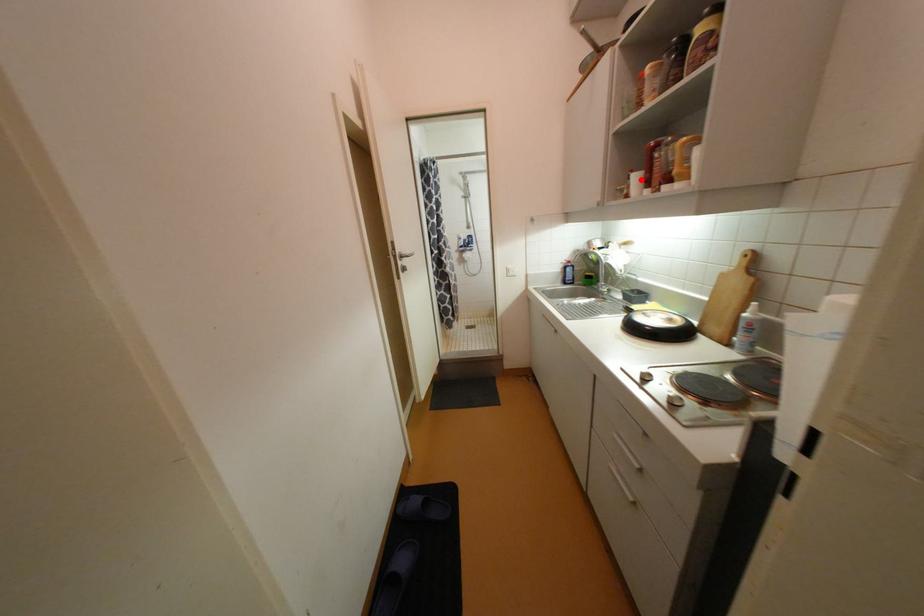
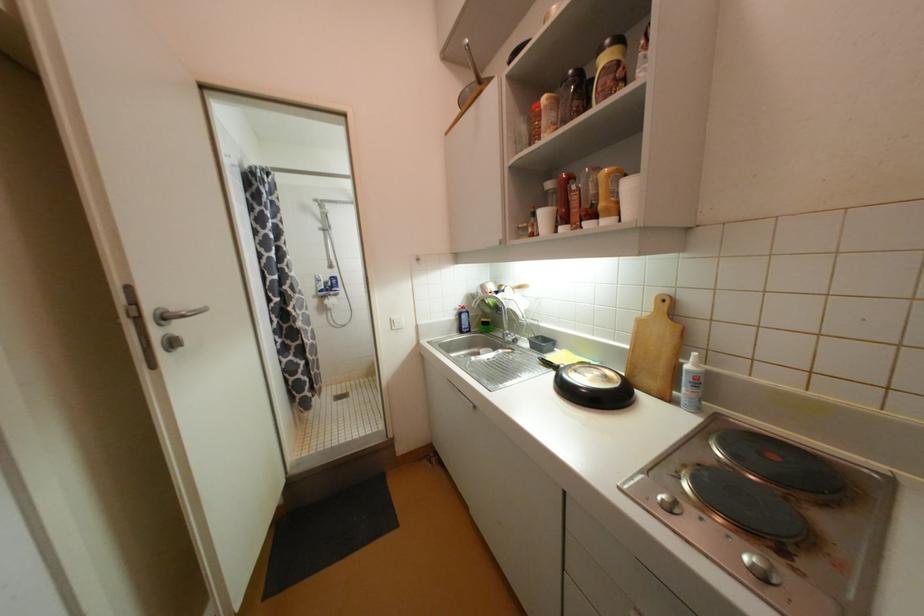
In the second image, find the point that corresponds to the highlighted location in the first image.

(550, 216)